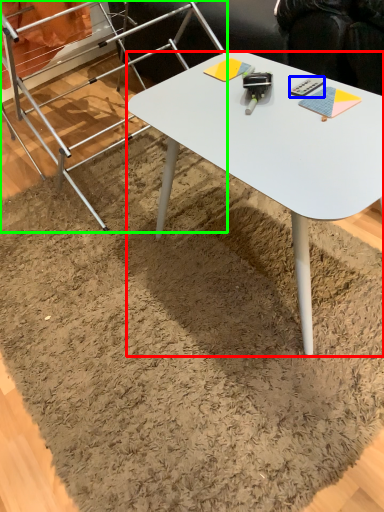
Question: Which object is positioned closest to desk (highlighted by a red box)? Select from remote control (highlighted by a blue box) and ladder (highlighted by a green box).

Choices:
 (A) remote control
 (B) ladder

Answer: (A)